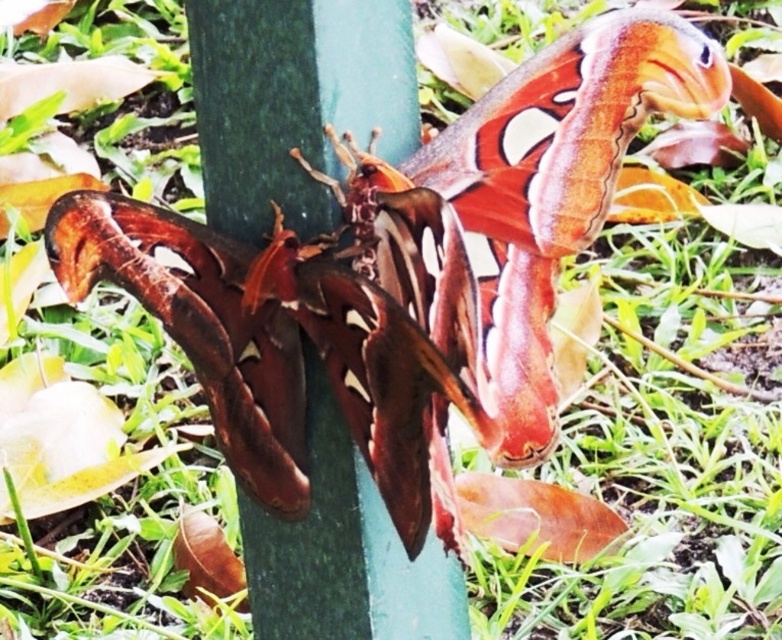
Question: Does green smooth pole at center have a larger size compared to matte brown butterfly at center?

Choices:
 (A) yes
 (B) no

Answer: (A)

Question: Is green smooth pole at center positioned before matte brown butterfly at center?

Choices:
 (A) yes
 (B) no

Answer: (B)

Question: Among these points, which one is farthest from the camera?

Choices:
 (A) (268, 332)
 (B) (320, 22)

Answer: (A)

Question: Can you confirm if green smooth pole at center is positioned below matte brown butterfly at center?

Choices:
 (A) yes
 (B) no

Answer: (A)